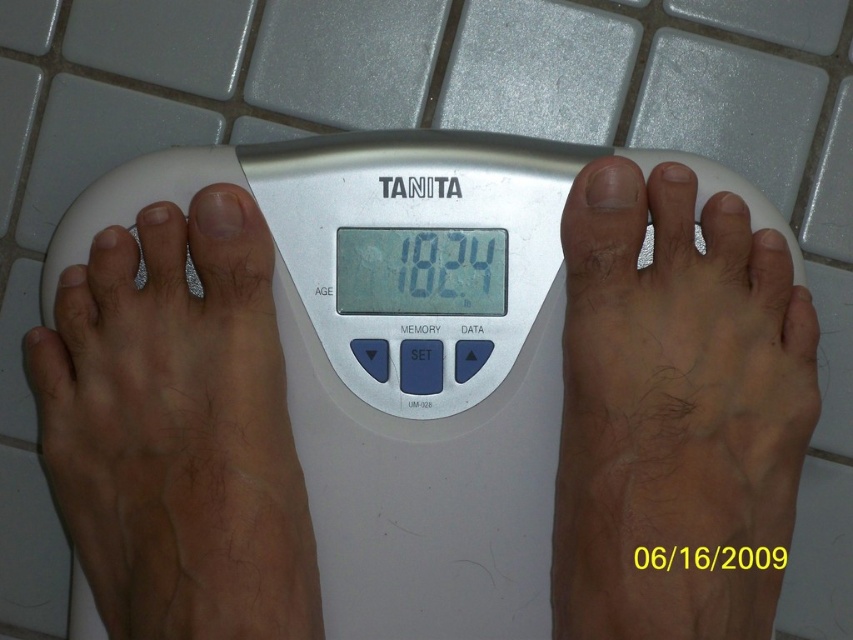
Who is lower down, white plastic weight scale at center or dry skin foot at center?

dry skin foot at center is lower down.

Is white plastic weight scale at center above dry skin foot at center?

Yes.

What do you see at coordinates (410, 353) in the screenshot? The width and height of the screenshot is (853, 640). I see `white plastic weight scale at center` at bounding box center [410, 353].

Image resolution: width=853 pixels, height=640 pixels. Identify the location of white plastic weight scale at center. (410, 353).

Can you confirm if dry skin foot at center is bigger than light brown skin at left?

No, dry skin foot at center is not bigger than light brown skin at left.

Based on the photo, is dry skin foot at center to the left of light brown skin at left from the viewer's perspective?

In fact, dry skin foot at center is to the right of light brown skin at left.

Who is more distant from viewer, (653,570) or (82,451)?

Point (82,451)

At what (x,y) coordinates should I click in order to perform the action: click on dry skin foot at center. Please return your answer as a coordinate pair (x, y). Looking at the image, I should click on (675, 412).

Which is below, white plastic weight scale at center or light brown skin at left?

Positioned lower is light brown skin at left.

Is point (547, 193) positioned in front of point (85, 387)?

That is False.

Locate an element on the screen. This screenshot has width=853, height=640. white plastic weight scale at center is located at coordinates (410, 353).